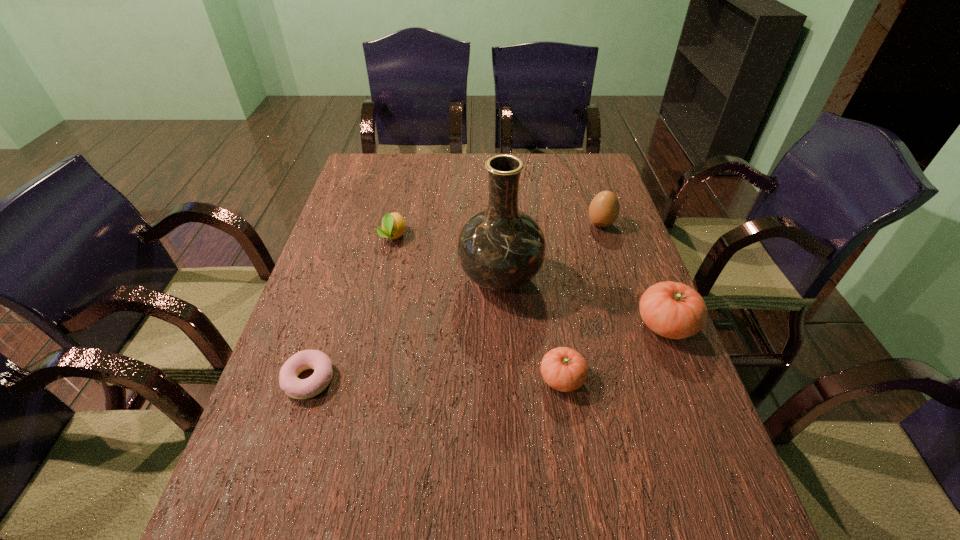
What are the coordinates of `free region located on the left of the farther tomato` in the screenshot? It's located at (574, 325).

Locate an element on the screen. This screenshot has height=540, width=960. vacant space located 0.060m with leaves positioned above the lemon is located at coordinates (387, 262).

Locate an element on the screen. The image size is (960, 540). vacant space located 0.390m on the front of the boiled egg is located at coordinates (636, 335).

The width and height of the screenshot is (960, 540). I want to click on blank space located 0.390m on the right of the doughnut, so click(x=514, y=379).

Locate an element on the screen. vacant region located 0.080m on the left of the tallest object is located at coordinates (429, 279).

You are a GUI agent. You are given a task and a screenshot of the screen. Output one action in this format:
    pyautogui.click(x=<x>, y=<y>)
    Task: Click on the lemon situated at the left edge
    This screenshot has width=960, height=540.
    Given the screenshot: What is the action you would take?
    pyautogui.click(x=393, y=224)

Identify the location of doughnut at the left edge. (296, 388).

This screenshot has width=960, height=540. I want to click on tomato present at the right edge, so click(x=674, y=310).

Find the location of a particular element. The width and height of the screenshot is (960, 540). boiled egg that is at the right edge is located at coordinates (604, 209).

I want to click on free space at the far edge of the desktop, so click(x=526, y=175).